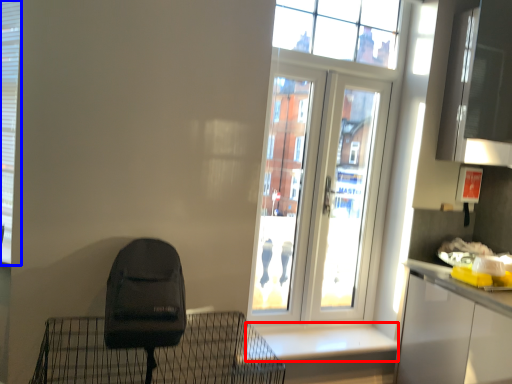
Question: Which object is closer to the camera taking this photo, window sill (highlighted by a red box) or shutter (highlighted by a blue box)?

Choices:
 (A) window sill
 (B) shutter

Answer: (B)